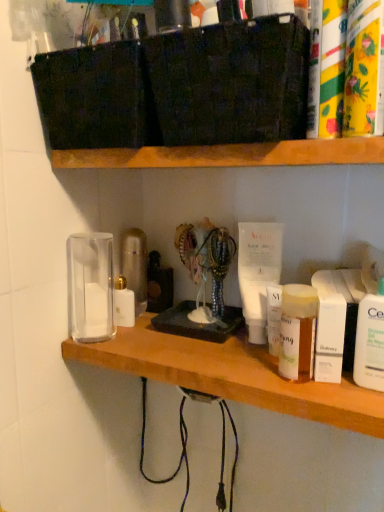
Question: Is floral-patterned plastic bottle at upper right, the fifth toiletry viewed from the left, aimed at white glossy lotion at left, the 1th toiletry in the left-to-right sequence?

Choices:
 (A) yes
 (B) no

Answer: (B)

Question: From the image's perspective, is floral-patterned plastic bottle at upper right, arranged as the 1th toiletry when viewed from the front, on white glossy lotion at left, placed as the 6th toiletry when sorted from front to back?

Choices:
 (A) yes
 (B) no

Answer: (A)

Question: Can you confirm if floral-patterned plastic bottle at upper right, arranged as the 1th toiletry when viewed from the front, is wider than white glossy lotion at left, placed as the 6th toiletry when sorted from front to back?

Choices:
 (A) yes
 (B) no

Answer: (A)

Question: From a real-world perspective, is floral-patterned plastic bottle at upper right, arranged as the 1th toiletry when viewed from the front, under white glossy lotion at left, placed as the 6th toiletry when sorted from front to back?

Choices:
 (A) yes
 (B) no

Answer: (B)

Question: Is the depth of floral-patterned plastic bottle at upper right, which is the second toiletry in right-to-left order, less than that of white glossy lotion at left, placed as the 6th toiletry when sorted from front to back?

Choices:
 (A) no
 (B) yes

Answer: (B)

Question: Can you confirm if floral-patterned plastic bottle at upper right, the fifth toiletry viewed from the left, is shorter than white glossy lotion at left, placed as the 6th toiletry when sorted from front to back?

Choices:
 (A) yes
 (B) no

Answer: (B)

Question: Is translucent plastic jar at center right, which ranks as the 5th toiletry in right-to-left order, positioned before white matte box at right, acting as the third toiletry starting from the back?

Choices:
 (A) yes
 (B) no

Answer: (B)

Question: Does translucent plastic jar at center right, the 2th toiletry when ordered from left to right, have a lesser height compared to white matte box at right, which appears as the 4th toiletry when viewed from the front?

Choices:
 (A) yes
 (B) no

Answer: (B)

Question: From the image's perspective, is translucent plastic jar at center right, which ranks as the 5th toiletry in right-to-left order, over white matte box at right, acting as the third toiletry starting from the back?

Choices:
 (A) no
 (B) yes

Answer: (B)

Question: From the image's perspective, is translucent plastic jar at center right, the second toiletry from the back, beneath white matte box at right, which is counted as the 3th toiletry, starting from the right?

Choices:
 (A) no
 (B) yes

Answer: (A)

Question: Is translucent plastic jar at center right, the 5th toiletry positioned from the front, oriented away from white matte box at right, which appears as the fourth toiletry when viewed from the left?

Choices:
 (A) yes
 (B) no

Answer: (B)

Question: Is translucent plastic jar at center right, which ranks as the 5th toiletry in right-to-left order, smaller than white matte box at right, which appears as the fourth toiletry when viewed from the left?

Choices:
 (A) yes
 (B) no

Answer: (B)

Question: Does white plastic lotion at right, which ranks as the first toiletry in right-to-left order, have a smaller size compared to wooden shelf at upper center, the second shelf ordered from the bottom?

Choices:
 (A) no
 (B) yes

Answer: (B)